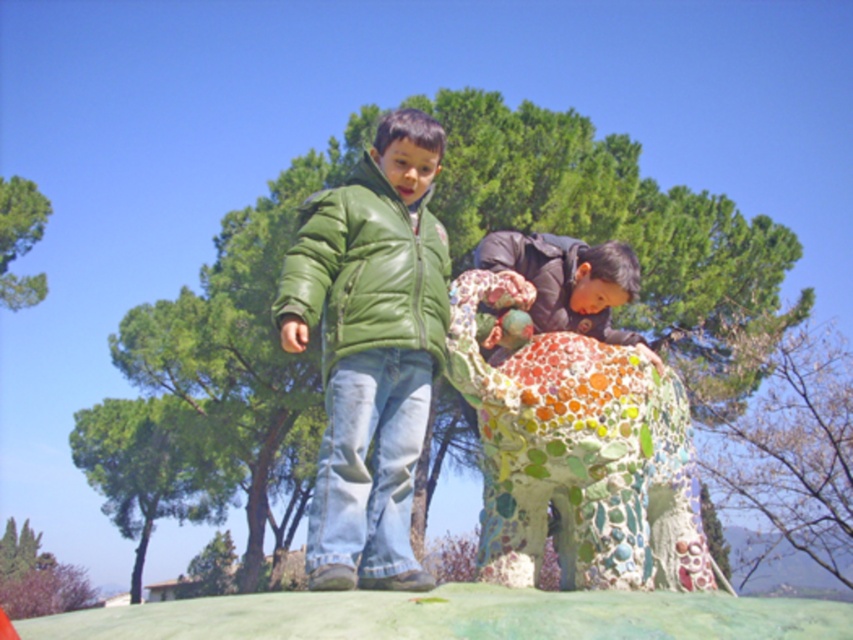
Question: Where is mosaic elephant at center located in relation to multicolored mosaic statue at center in the image?

Choices:
 (A) left
 (B) right

Answer: (A)

Question: Which point appears closest to the camera in this image?

Choices:
 (A) (346, 204)
 (B) (549, 300)

Answer: (A)

Question: Does green matte jacket at center have a larger size compared to multicolored mosaic statue at center?

Choices:
 (A) yes
 (B) no

Answer: (A)

Question: Which point is farther from the camera taking this photo?

Choices:
 (A) (303, 339)
 (B) (584, 291)
 (C) (392, 371)
 (D) (607, 515)

Answer: (B)

Question: Is green matte jacket at center to the left of multicolored mosaic statue at center from the viewer's perspective?

Choices:
 (A) no
 (B) yes

Answer: (B)

Question: Which of the following is the closest to the observer?

Choices:
 (A) green leather jacket at center
 (B) mosaic elephant at center
 (C) multicolored mosaic statue at center
 (D) green matte jacket at center

Answer: (D)